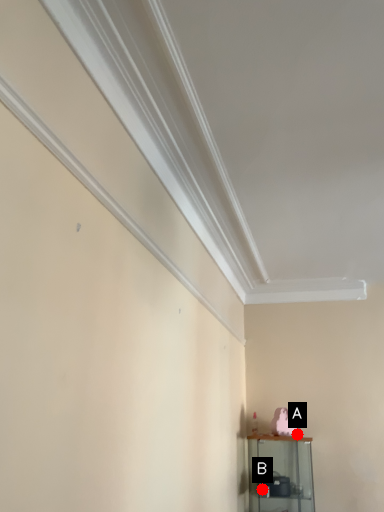
Question: Two points are circled on the image, labeled by A and B beside each circle. Among these points, which one is nearest to the camera?

Choices:
 (A) A is closer
 (B) B is closer

Answer: (B)